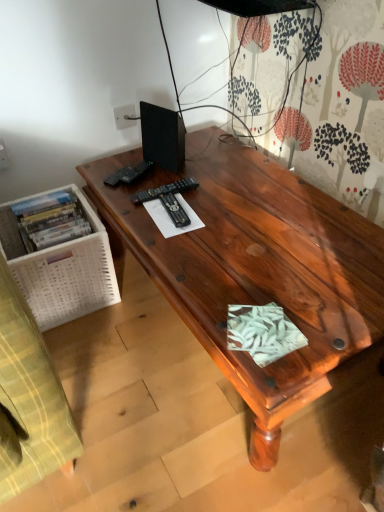
This screenshot has height=512, width=384. I want to click on spots to the right of black plastic remote control at upper left, marked as the third remote control in a front-to-back arrangement, so click(x=193, y=173).